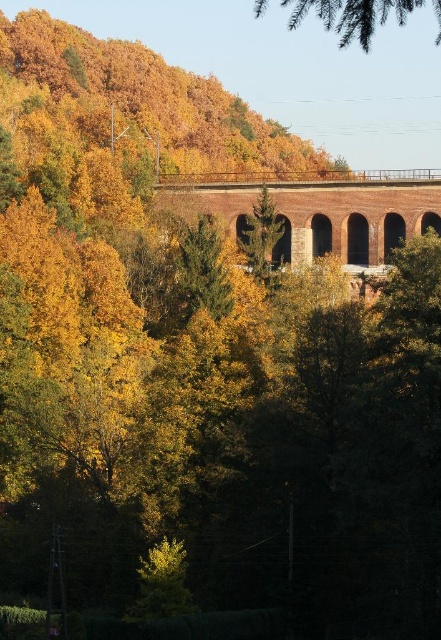
Does green leafy tree at lower center appear under green matte tree at center?

Correct, green leafy tree at lower center is located below green matte tree at center.

Who is more forward, [171,579] or [238,218]?

Point [171,579]

You are a GUI agent. You are given a task and a screenshot of the screen. Output one action in this format:
    pyautogui.click(x=<x>, y=<y>)
    Task: Click on the green leafy tree at lower center
    
    Given the screenshot: What is the action you would take?
    pyautogui.click(x=161, y=582)

Does brick stone train bridge at center appear on the left side of green matte tree at center?

Incorrect, brick stone train bridge at center is not on the left side of green matte tree at center.

The height and width of the screenshot is (640, 441). Describe the element at coordinates (318, 209) in the screenshot. I see `brick stone train bridge at center` at that location.

Locate an element on the screen. The image size is (441, 640). brick stone train bridge at center is located at coordinates (318, 209).

Which is above, green needle-like branches at upper center or green leafy tree at lower center?

green needle-like branches at upper center is above.

Looking at this image, is green needle-like branches at upper center wider than green leafy tree at lower center?

Indeed, green needle-like branches at upper center has a greater width compared to green leafy tree at lower center.

Is point (343, 12) closer to camera compared to point (176, 577)?

Yes, point (343, 12) is in front of point (176, 577).

Identify the location of green needle-like branches at upper center. (357, 16).